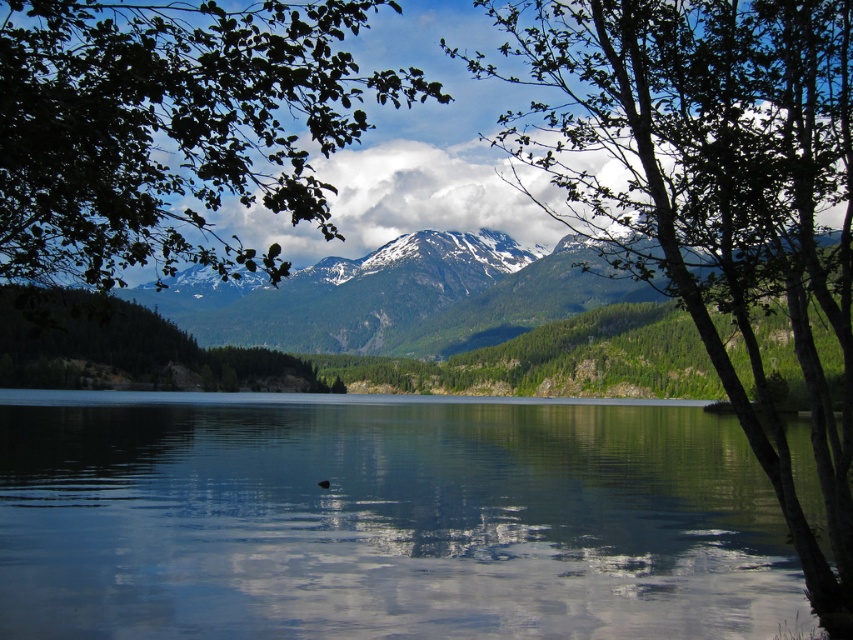
You are standing at the edge of the water and want to look up towards the green leafy tree at upper left. Which direction should you look relative to the transparent water at center?

You should look upwards relative to the transparent water at center because the green leafy tree at upper left is located above it.

You are standing at the center of the image and want to locate the green leafy tree at center. What are the coordinates of its position?

The green leafy tree at center is located at coordinates point (712, 193).

You are standing at the edge of the water and see the point labeled as point [383,520]. What is the nature of the surface at that point?

The point [383,520] indicates transparent water at center, so the surface there is transparent water.